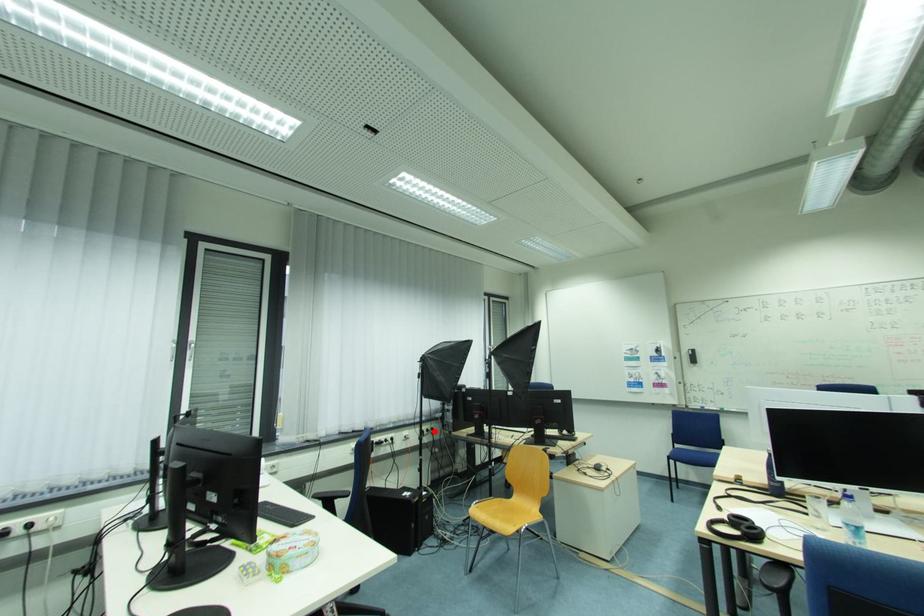
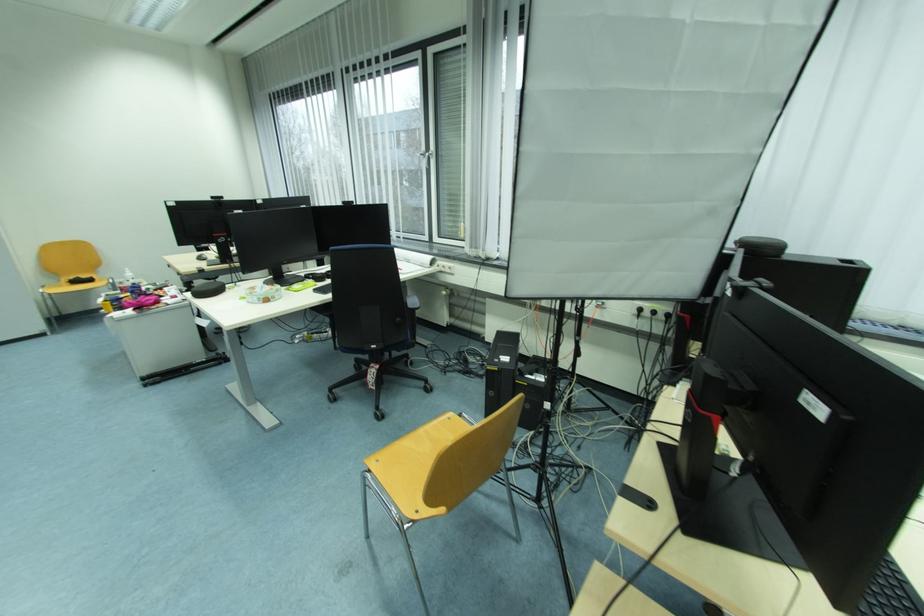
The point at the highlighted location is marked in the first image. Where is the corresponding point in the second image?

(662, 314)